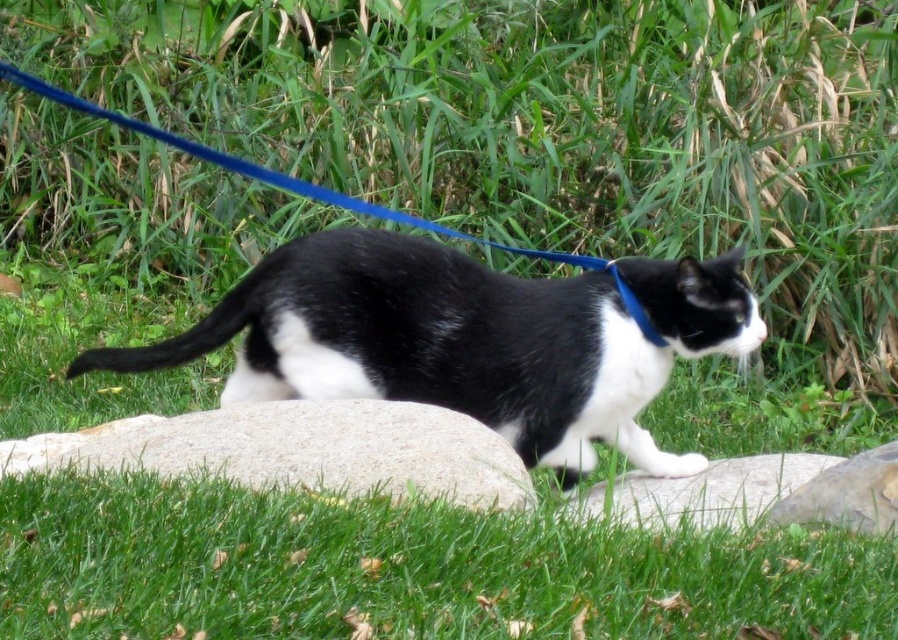
Question: Is black/white fur cat at center positioned in front of smooth gray rock at lower right?

Choices:
 (A) no
 (B) yes

Answer: (A)

Question: Which of the following is the farthest from the observer?

Choices:
 (A) (709, 301)
 (B) (571, 499)
 (C) (823, 483)
 (D) (498, 460)

Answer: (A)

Question: Which point is closer to the camera taking this photo?

Choices:
 (A) (269, 403)
 (B) (238, 284)

Answer: (A)

Question: Can you confirm if black/white fur cat at center is positioned below gray smooth rock at center?

Choices:
 (A) no
 (B) yes

Answer: (A)

Question: Which point is closer to the camera?

Choices:
 (A) (876, 621)
 (B) (729, 307)
 (C) (580, 262)

Answer: (A)

Question: Is green grass at lower center smaller than blue fabric neckband at center?

Choices:
 (A) no
 (B) yes

Answer: (A)